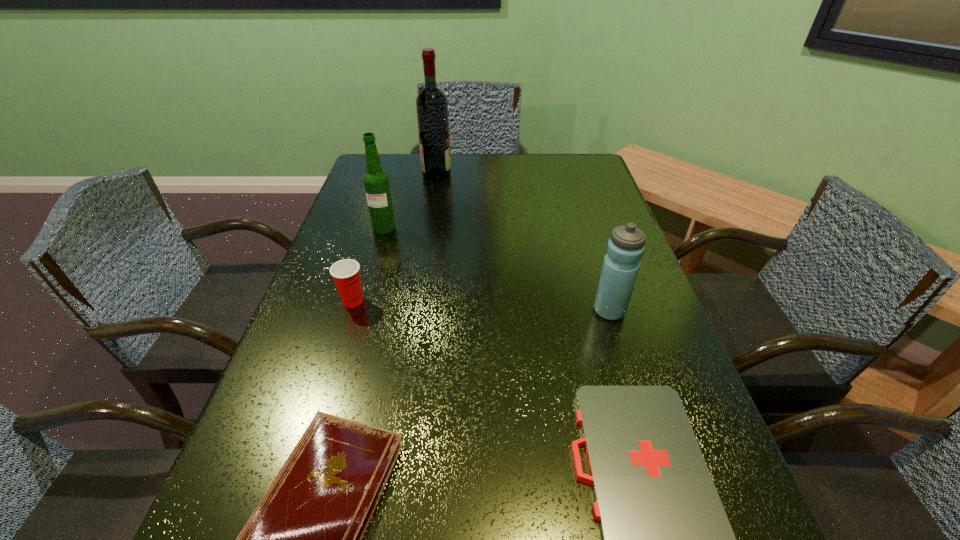
In order to click on the farthest object in this screenshot , I will do `click(431, 103)`.

In order to click on the tallest object in this screenshot , I will do `click(431, 103)`.

The width and height of the screenshot is (960, 540). Find the location of `beer bottle`. beer bottle is located at coordinates (376, 181).

Image resolution: width=960 pixels, height=540 pixels. In order to click on the third tallest object in this screenshot , I will do `click(625, 248)`.

Where is `the fourth tallest object`? the fourth tallest object is located at coordinates (346, 273).

The width and height of the screenshot is (960, 540). I want to click on free space located on the front and back of the alcohol, so click(x=547, y=175).

In order to click on vacant area situated on the label of the second farthest object in this screenshot , I will do `click(360, 312)`.

You are a GUI agent. You are given a task and a screenshot of the screen. Output one action in this format:
    pyautogui.click(x=<x>, y=<y>)
    Task: Click on the free space located 0.060m on the right of the water bottle
    
    Given the screenshot: What is the action you would take?
    pyautogui.click(x=653, y=310)

Locate an element on the screen. The height and width of the screenshot is (540, 960). vacant space located 0.230m on the back of the third shortest object is located at coordinates (374, 234).

The width and height of the screenshot is (960, 540). In order to click on object present at the far edge in this screenshot , I will do `click(431, 103)`.